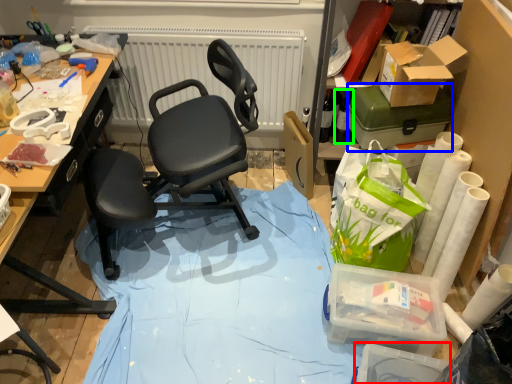
Question: Which is nearer to the box (highlighted by a red box)? box (highlighted by a blue box) or bottle (highlighted by a green box).

Choices:
 (A) box
 (B) bottle

Answer: (A)